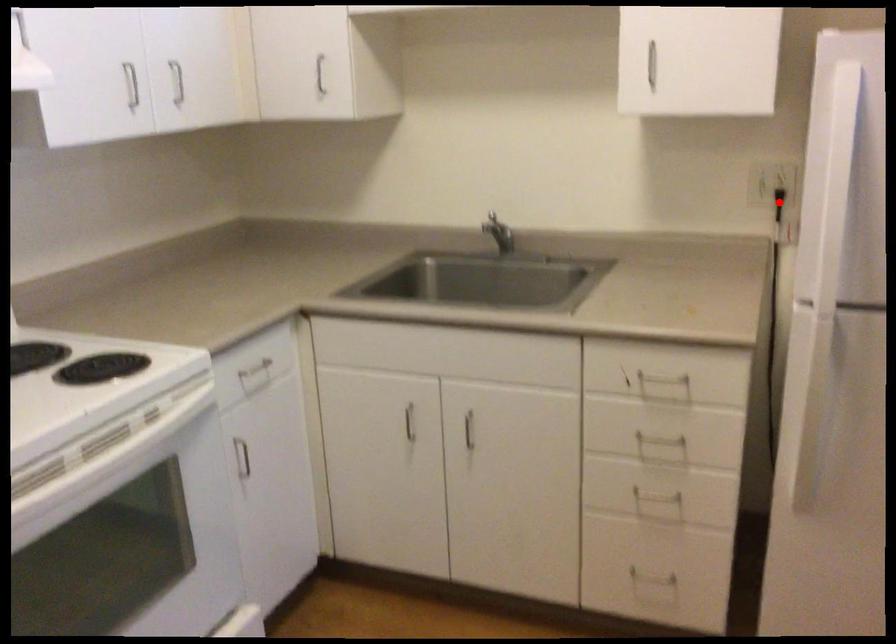
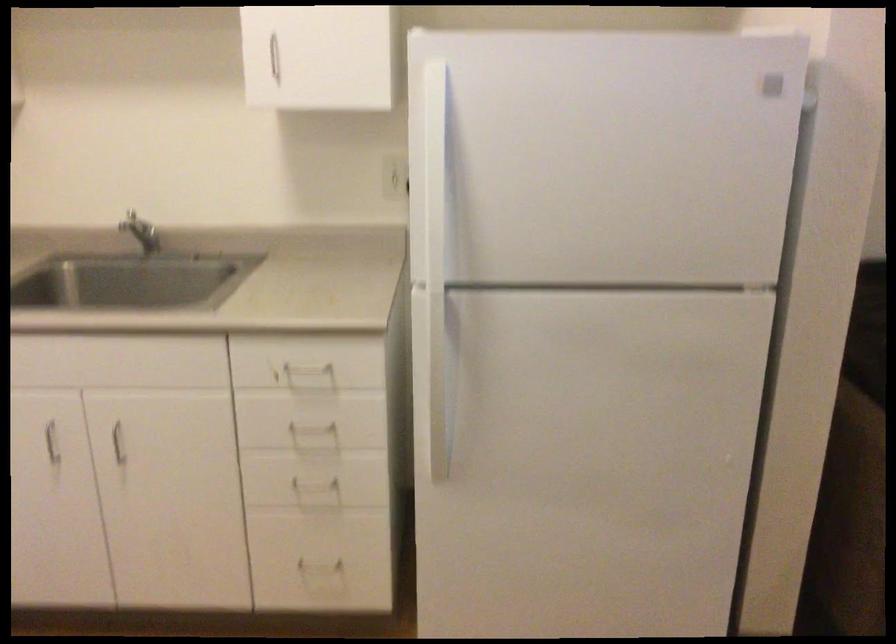
Question: I am providing you with two images of the same scene from different viewpoints. A red point is marked on the first image. Is the red point's position out of view in image 2?

Choices:
 (A) Yes
 (B) No

Answer: (A)